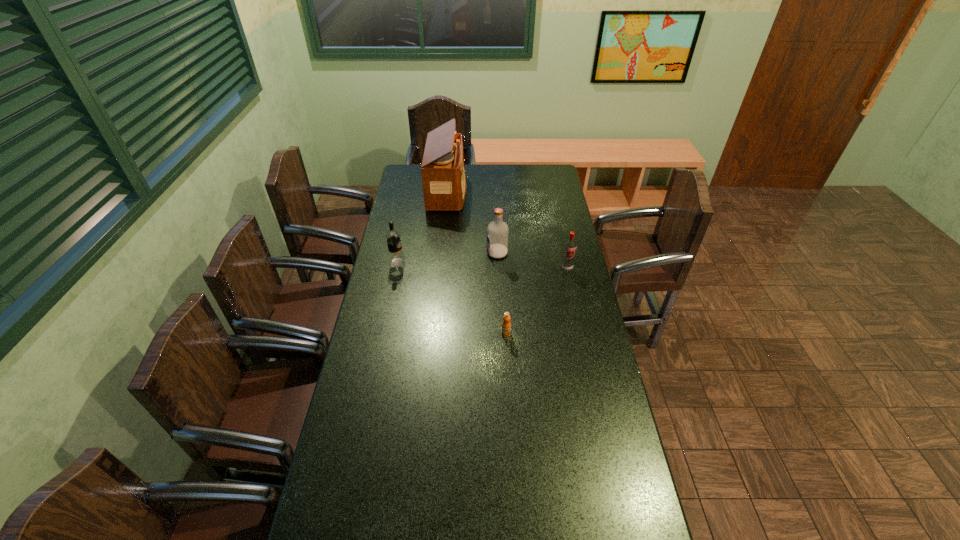
In the image, there is a desktop. What are the coordinates of `free space at the far edge` in the screenshot? It's located at (486, 182).

You are a GUI agent. You are given a task and a screenshot of the screen. Output one action in this format:
    pyautogui.click(x=<x>, y=<y>)
    Task: Click on the vacant position at the left edge of the desktop
    The image size is (960, 540).
    Given the screenshot: What is the action you would take?
    pos(370,304)

Where is `vacant space at the right edge of the desktop`? vacant space at the right edge of the desktop is located at coordinates (584, 411).

Identify the location of vacant area between the fourth tallest object and the nearest object. The image size is (960, 540). (536, 301).

You are a GUI agent. You are given a task and a screenshot of the screen. Output one action in this format:
    pyautogui.click(x=<x>, y=<y>)
    Task: Click on the unoccupied area between the rightmost object and the leftmost object
    The height and width of the screenshot is (540, 960).
    Given the screenshot: What is the action you would take?
    pyautogui.click(x=482, y=265)

You are a GUI agent. You are given a task and a screenshot of the screen. Output one action in this format:
    pyautogui.click(x=<x>, y=<y>)
    Task: Click on the unoccupied position between the leftmost vodka and the radio receiver
    
    Given the screenshot: What is the action you would take?
    pyautogui.click(x=422, y=227)

Identify the location of free space between the shortest vodka and the leftmost object. The image size is (960, 540). (482, 265).

Where is `vacant area between the leftmost object and the radio receiver`? The height and width of the screenshot is (540, 960). vacant area between the leftmost object and the radio receiver is located at coordinates (422, 227).

You are a GUI agent. You are given a task and a screenshot of the screen. Output one action in this format:
    pyautogui.click(x=<x>, y=<y>)
    Task: Click on the free space between the second vodka from left to right and the rightmost object
    The image size is (960, 540).
    Given the screenshot: What is the action you would take?
    click(532, 260)

In order to click on empty space that is in between the tallest object and the leftmost object in this screenshot , I will do [x=422, y=227].